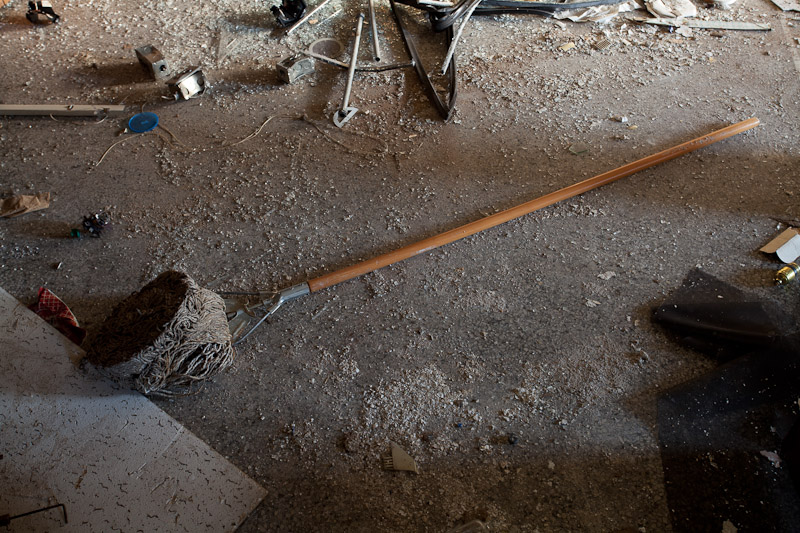
The width and height of the screenshot is (800, 533). Find the location of `mop handle`. mop handle is located at coordinates (372, 264).